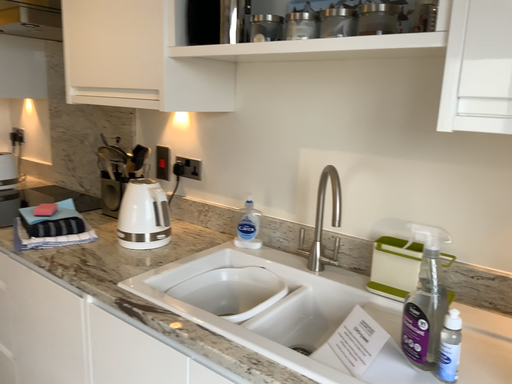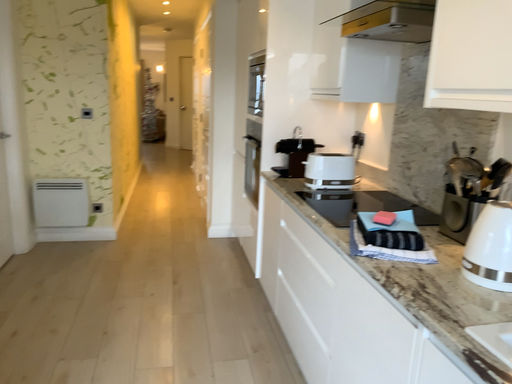
Question: Which way did the camera rotate in the video?

Choices:
 (A) rotated left
 (B) rotated right

Answer: (A)